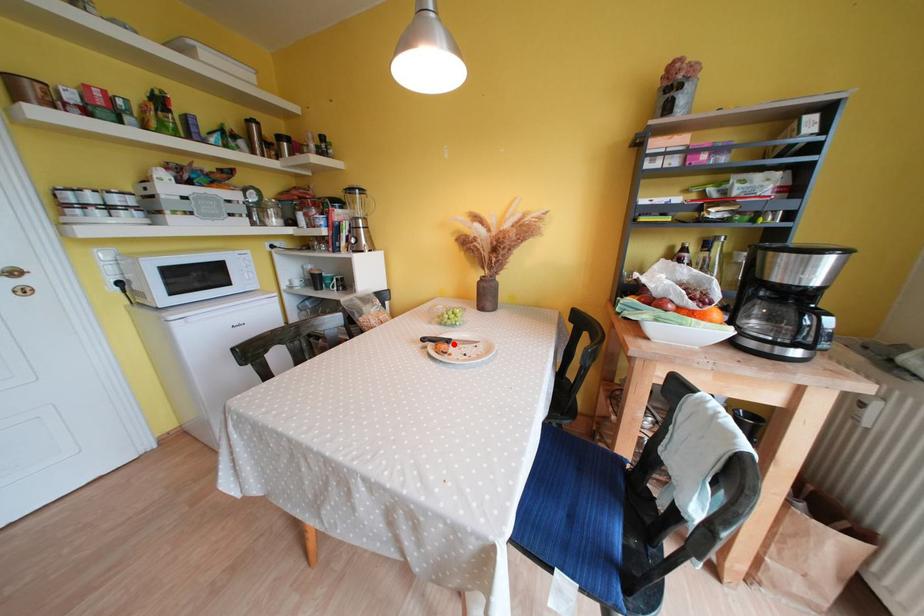
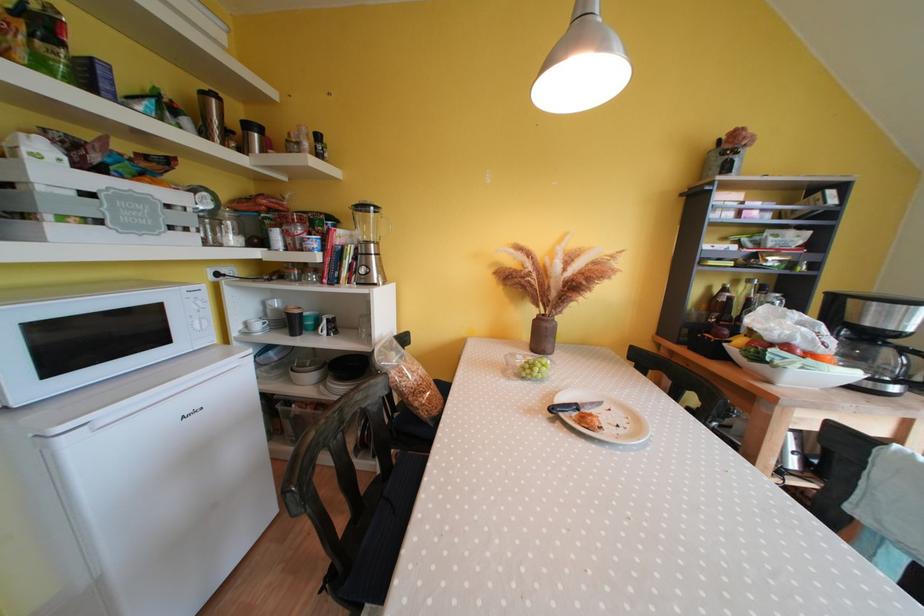
Where in the second image is the point corresponding to the highlighted location from the first image?

(582, 410)